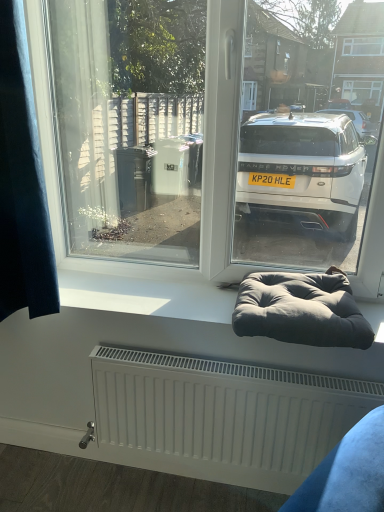
This screenshot has height=512, width=384. In order to click on vacant space in dark blue fabric at left (from a real-world perspective) in this screenshot , I will do [39, 463].